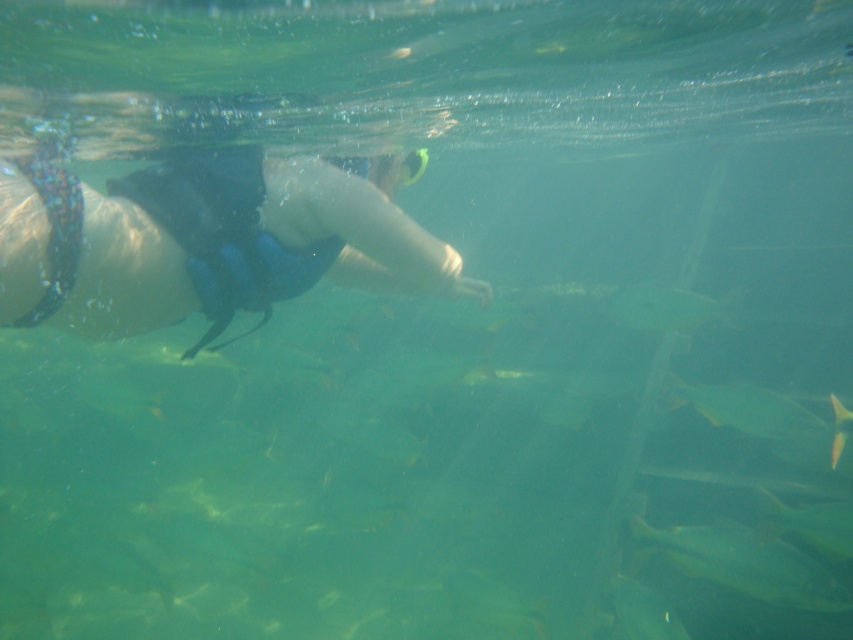
You are a marine biologist observing the underwater scene. You notice two fish species in the image. The first is the green matte fish at lower right, and the second is the green translucent fish at center. Which of these two fish is positioned closer to the ocean floor?

The green matte fish at lower right is positioned closer to the ocean floor because it is located below the green translucent fish at center.